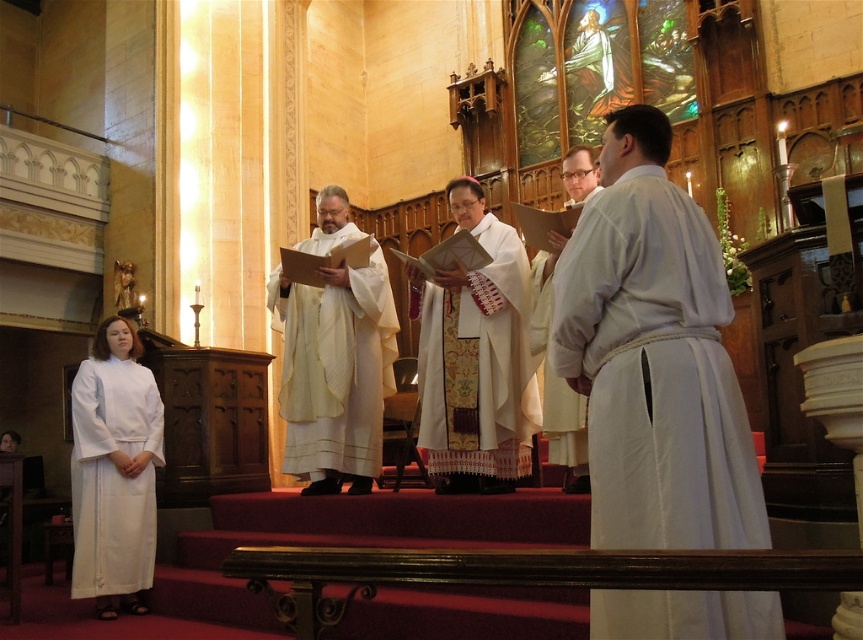
Question: Which point appears farthest from the camera in this image?

Choices:
 (A) (564, 420)
 (B) (524, 392)
 (C) (704, 442)

Answer: (B)

Question: Can you confirm if white satin robe at center is positioned above white clothed man at center?

Choices:
 (A) yes
 (B) no

Answer: (A)

Question: Which of the following is the closest to the observer?

Choices:
 (A) white clothed man at center
 (B) white matte robe at center

Answer: (B)

Question: Is white textured fabric at center above white clothed man at center?

Choices:
 (A) no
 (B) yes

Answer: (B)

Question: Can you confirm if white matte/soft fabric at left is smaller than white clothed man at center?

Choices:
 (A) no
 (B) yes

Answer: (A)

Question: Which object is farther from the camera taking this photo?

Choices:
 (A) white clothed man at center
 (B) white satin robe at center
 (C) white textured fabric at center
 (D) white matte/soft fabric at left

Answer: (B)